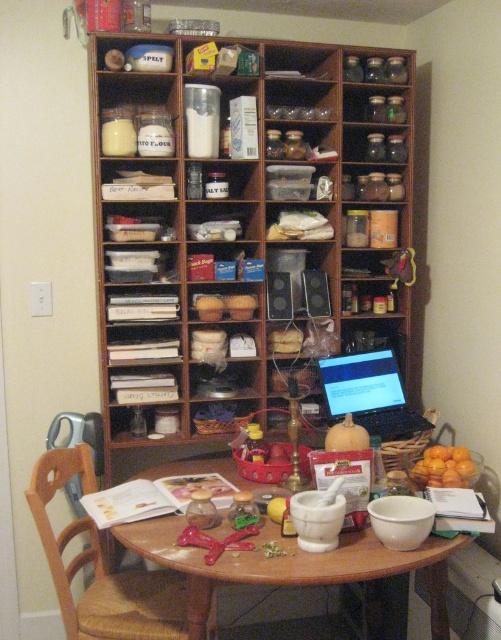
You are trying to place a new item on the table. The wooden at left and yellow matte pumpkin at center are already there. Which object has a wider base so it can support a heavier item?

The wooden at left has a larger width than the yellow matte pumpkin at center, making it more suitable to support a heavier item due to its wider base.

You are organizing items on a round wooden table in a cozy kitchen corner. You have a white ceramic mortar and pestle at center and a black plastic laptop at center. Which item is located below the other?

The white ceramic mortar and pestle at center is positioned under the black plastic laptop at center, so the mortar and pestle is below the laptop.